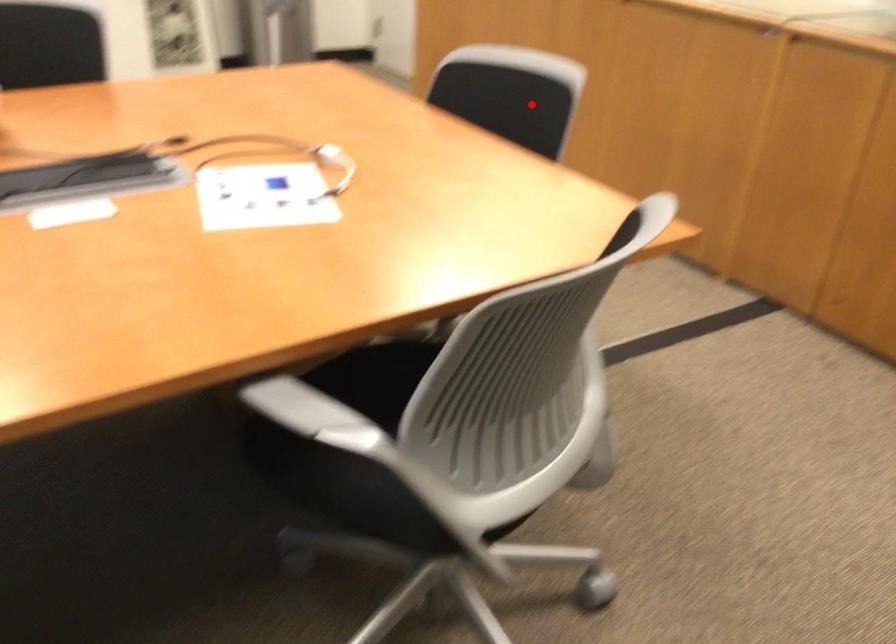
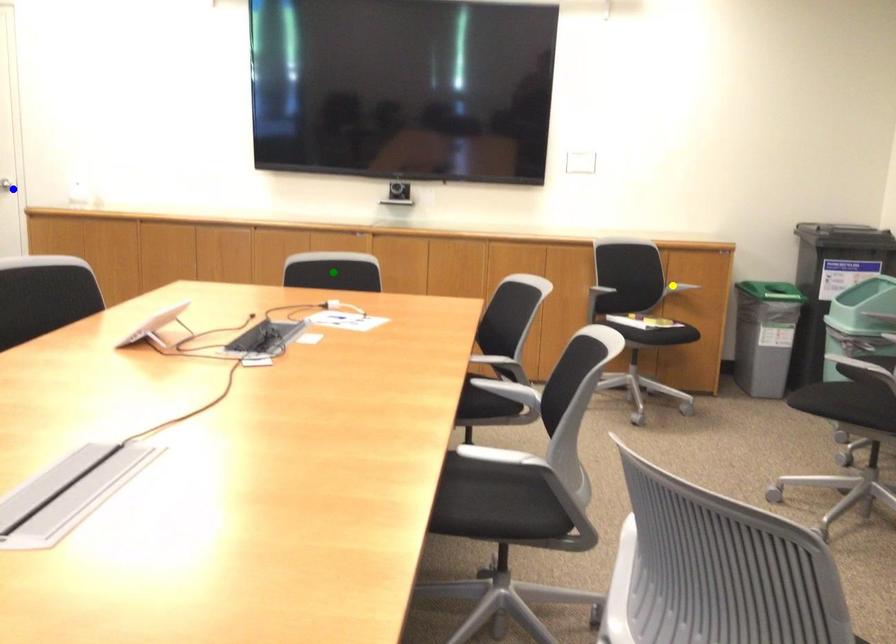
Question: I am providing you with two images of the same scene from different viewpoints. A red point is marked on the first image. You are given multiple points on the second image. Which mark in image 2 goes with the point in image 1?

Choices:
 (A) green point
 (B) blue point
 (C) yellow point

Answer: (A)